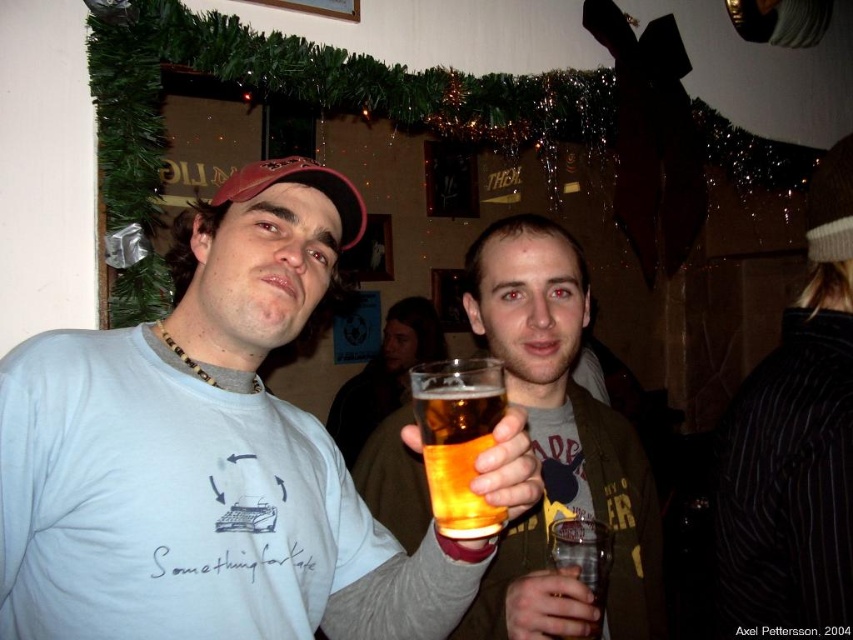
Does translucent glass at center appear under translucent plastic cup at center?

No, translucent glass at center is not below translucent plastic cup at center.

Which of these two, translucent glass at center or translucent plastic cup at center, stands taller?

Standing taller between the two is translucent glass at center.

You are a GUI agent. You are given a task and a screenshot of the screen. Output one action in this format:
    pyautogui.click(x=<x>, y=<y>)
    Task: Click on the translucent glass at center
    
    Given the screenshot: What is the action you would take?
    pyautogui.click(x=457, y=440)

The height and width of the screenshot is (640, 853). I want to click on translucent glass at center, so click(457, 440).

Which is more to the left, matte white t-shirt at center or matte brown jacket at center?

From the viewer's perspective, matte white t-shirt at center appears more on the left side.

The width and height of the screenshot is (853, 640). What are the coordinates of `matte white t-shirt at center` in the screenshot? It's located at (207, 458).

Is point (444, 516) positioned behind point (433, 323)?

No, it is in front of (433, 323).

Does translucent glass at center have a smaller size compared to translucent glass mug at center?

Correct, translucent glass at center occupies less space than translucent glass mug at center.

The width and height of the screenshot is (853, 640). Identify the location of translucent glass at center. (457, 440).